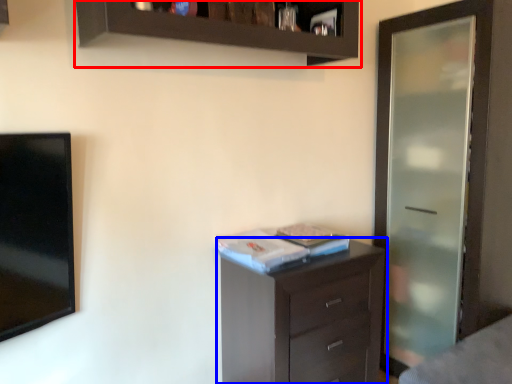
Question: Which object is closer to the camera taking this photo, cupboard (highlighted by a red box) or chest of drawers (highlighted by a blue box)?

Choices:
 (A) cupboard
 (B) chest of drawers

Answer: (A)